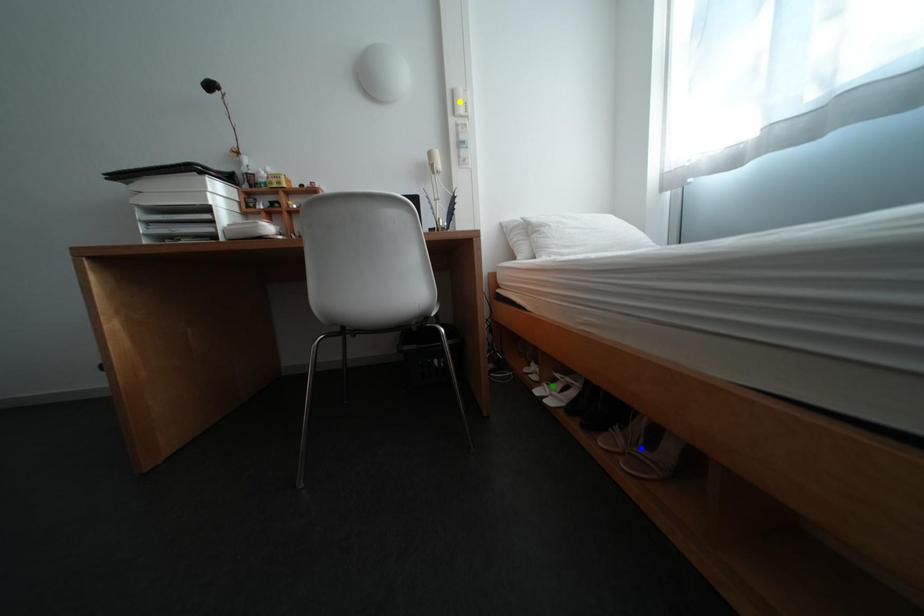
Order these from nearest to farthest:
green point | blue point | yellow point

yellow point < green point < blue point